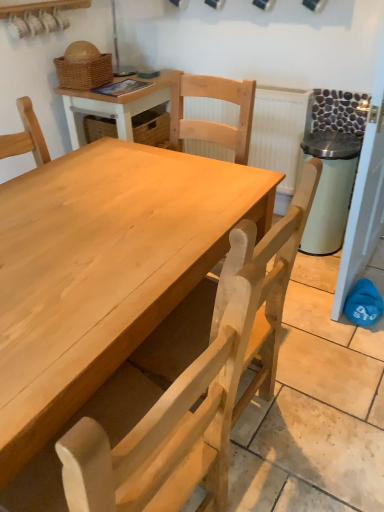
Question: Is white textured radiator at upper center aimed at natural wood chair at center?

Choices:
 (A) yes
 (B) no

Answer: (A)

Question: Is white textured radiator at upper center smaller than natural wood chair at center?

Choices:
 (A) yes
 (B) no

Answer: (A)

Question: Is white textured radiator at upper center positioned in front of natural wood chair at center?

Choices:
 (A) no
 (B) yes

Answer: (A)

Question: From the image's perspective, is white textured radiator at upper center above natural wood chair at center?

Choices:
 (A) no
 (B) yes

Answer: (B)

Question: From a real-world perspective, is white textured radiator at upper center under natural wood chair at center?

Choices:
 (A) no
 (B) yes

Answer: (A)

Question: Is white textured radiator at upper center positioned behind natural wood chair at center?

Choices:
 (A) no
 (B) yes

Answer: (B)

Question: Is white textured radiator at upper center to the right of wooden table at center from the viewer's perspective?

Choices:
 (A) no
 (B) yes

Answer: (B)

Question: Is white textured radiator at upper center at the left side of wooden table at center?

Choices:
 (A) no
 (B) yes

Answer: (A)

Question: Is white textured radiator at upper center not inside wooden table at center?

Choices:
 (A) no
 (B) yes

Answer: (B)

Question: From a real-world perspective, does white textured radiator at upper center sit lower than wooden table at center?

Choices:
 (A) no
 (B) yes

Answer: (A)

Question: Does white textured radiator at upper center have a larger size compared to wooden table at center?

Choices:
 (A) yes
 (B) no

Answer: (B)

Question: Considering the relative sizes of white textured radiator at upper center and wooden table at center in the image provided, is white textured radiator at upper center taller than wooden table at center?

Choices:
 (A) yes
 (B) no

Answer: (B)

Question: Could you tell me if woven brown basket at upper left is turned towards white textured radiator at upper center?

Choices:
 (A) yes
 (B) no

Answer: (B)